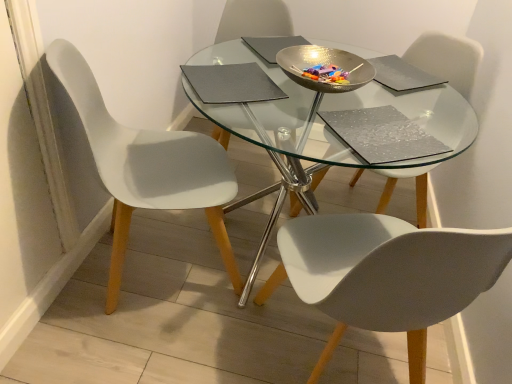
Question: From a real-world perspective, is white matte chair at center, which ranks as the second chair in right-to-left order, on white matte chair at center, the 1th chair from the right?

Choices:
 (A) no
 (B) yes

Answer: (A)

Question: Is white matte chair at center, the second chair positioned from the left, aimed at white matte chair at center, which appears as the third chair when viewed from the left?

Choices:
 (A) yes
 (B) no

Answer: (A)

Question: From a real-world perspective, is white matte chair at center, the second chair positioned from the left, positioned under white matte chair at center, which appears as the third chair when viewed from the left, based on gravity?

Choices:
 (A) no
 (B) yes

Answer: (B)

Question: Is white matte chair at center, the second chair positioned from the left, oriented away from white matte chair at center, which appears as the third chair when viewed from the left?

Choices:
 (A) no
 (B) yes

Answer: (A)

Question: Is white matte chair at center, which ranks as the second chair in right-to-left order, taller than white matte chair at center, the 1th chair from the right?

Choices:
 (A) no
 (B) yes

Answer: (A)

Question: From the image's perspective, relative to white matte chair at center, the 1th chair from the right, is silver textured pad at center, the fourth pad positioned from the top, above or below?

Choices:
 (A) above
 (B) below

Answer: (B)

Question: Is silver textured pad at center, the fourth pad positioned from the top, taller or shorter than white matte chair at center, the 1th chair from the right?

Choices:
 (A) short
 (B) tall

Answer: (A)

Question: From a real-world perspective, is silver textured pad at center, placed as the first pad when sorted from bottom to top, physically located above or below white matte chair at center, the 1th chair from the right?

Choices:
 (A) above
 (B) below

Answer: (A)

Question: Considering their positions, is silver textured pad at center, the fourth pad positioned from the top, located in front of or behind white matte chair at center, which appears as the third chair when viewed from the left?

Choices:
 (A) front
 (B) behind

Answer: (A)

Question: In terms of height, does white matte chair at center, the 1th chair from the right, look taller or shorter compared to matte gray pad at center, which is counted as the second pad, starting from the bottom?

Choices:
 (A) short
 (B) tall

Answer: (B)

Question: Does point (464, 89) appear closer or farther from the camera than point (186, 72)?

Choices:
 (A) closer
 (B) farther

Answer: (B)

Question: Is white matte chair at center, the 1th chair from the right, inside or outside of matte gray pad at center, which is counted as the second pad, starting from the bottom?

Choices:
 (A) outside
 (B) inside

Answer: (A)

Question: Is white matte chair at center, the 1th chair from the right, bigger or smaller than matte gray pad at center, the third pad viewed from the top?

Choices:
 (A) small
 (B) big

Answer: (B)

Question: In terms of width, does hammered metal bowl at center look wider or thinner when compared to matte gray pad at upper center, positioned as the 4th pad in bottom-to-top order?

Choices:
 (A) wide
 (B) thin

Answer: (A)

Question: From the image's perspective, is hammered metal bowl at center located above or below matte gray pad at upper center, positioned as the 4th pad in bottom-to-top order?

Choices:
 (A) below
 (B) above

Answer: (A)